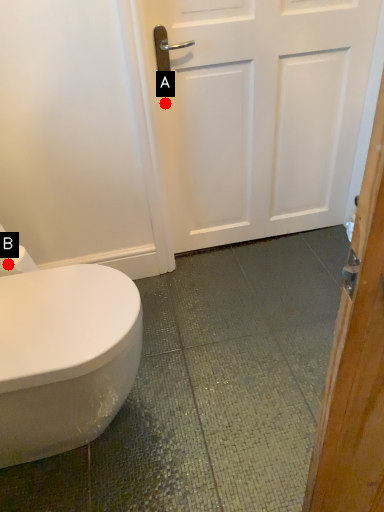
Question: Two points are circled on the image, labeled by A and B beside each circle. Which point is closer to the camera?

Choices:
 (A) A is closer
 (B) B is closer

Answer: (B)